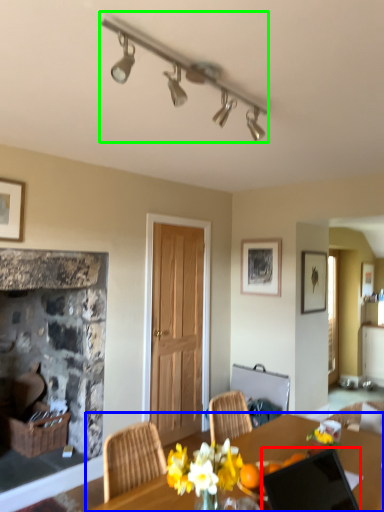
Question: Which object is positioned closest to laptop (highlighted by a red box)? Select from desk (highlighted by a blue box) and lamp (highlighted by a green box).

Choices:
 (A) desk
 (B) lamp

Answer: (A)